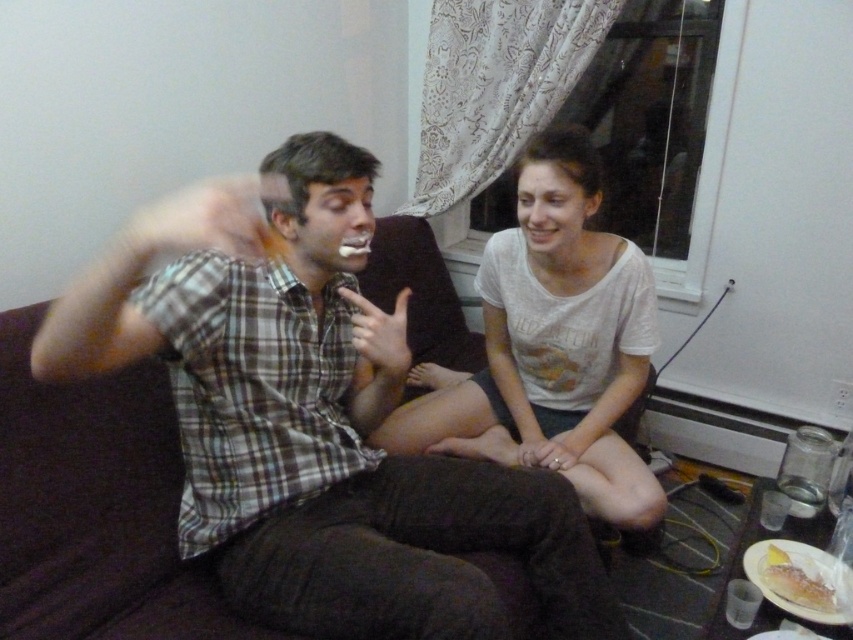
Between white cotton shirt at center and yellow cake at lower right, which one appears on the left side from the viewer's perspective?

white cotton shirt at center is more to the left.

Locate an element on the screen. The width and height of the screenshot is (853, 640). white cotton shirt at center is located at coordinates [x=553, y=346].

You are a GUI agent. You are given a task and a screenshot of the screen. Output one action in this format:
    pyautogui.click(x=<x>, y=<y>)
    Task: Click on the white cotton shirt at center
    This screenshot has height=640, width=853.
    Given the screenshot: What is the action you would take?
    pyautogui.click(x=553, y=346)

What are the coordinates of `white cotton shirt at center` in the screenshot? It's located at (553, 346).

Can you confirm if plaid shirt at center is bigger than white cotton shirt at center?

Correct, plaid shirt at center is larger in size than white cotton shirt at center.

Is point (402, 326) positioned behind point (500, 451)?

No, it is not.

Find the location of a particular element. plaid shirt at center is located at coordinates (312, 417).

Does plaid shirt at center have a greater width compared to yellow cake at lower right?

Yes.

Which is more to the right, plaid shirt at center or yellow cake at lower right?

Positioned to the right is yellow cake at lower right.

Does point (329, 589) come behind point (793, 577)?

No, (329, 589) is in front of (793, 577).

Locate an element on the screen. The height and width of the screenshot is (640, 853). plaid shirt at center is located at coordinates (312, 417).